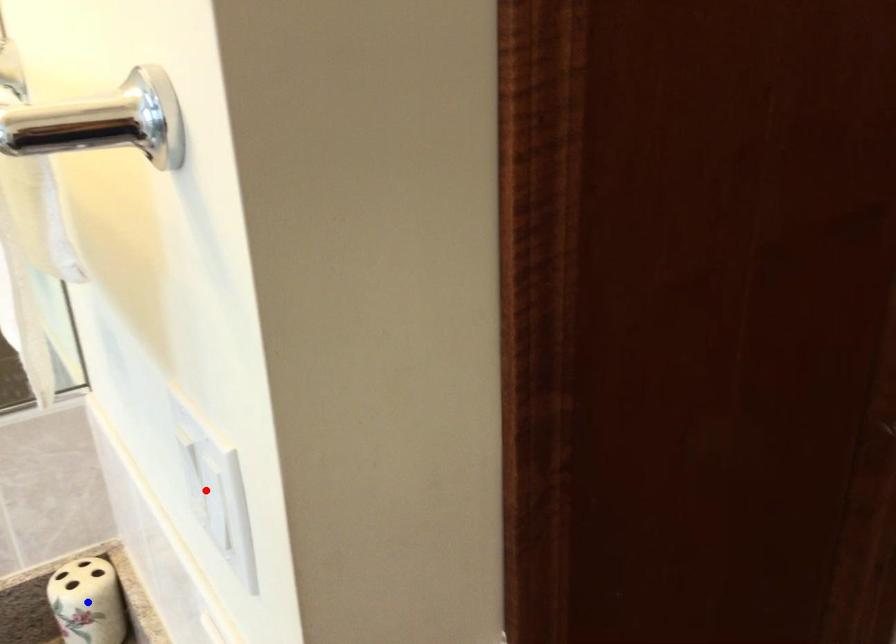
Question: Which of the two points in the image is closer to the camera?

Choices:
 (A) Blue point is closer.
 (B) Red point is closer.

Answer: (B)